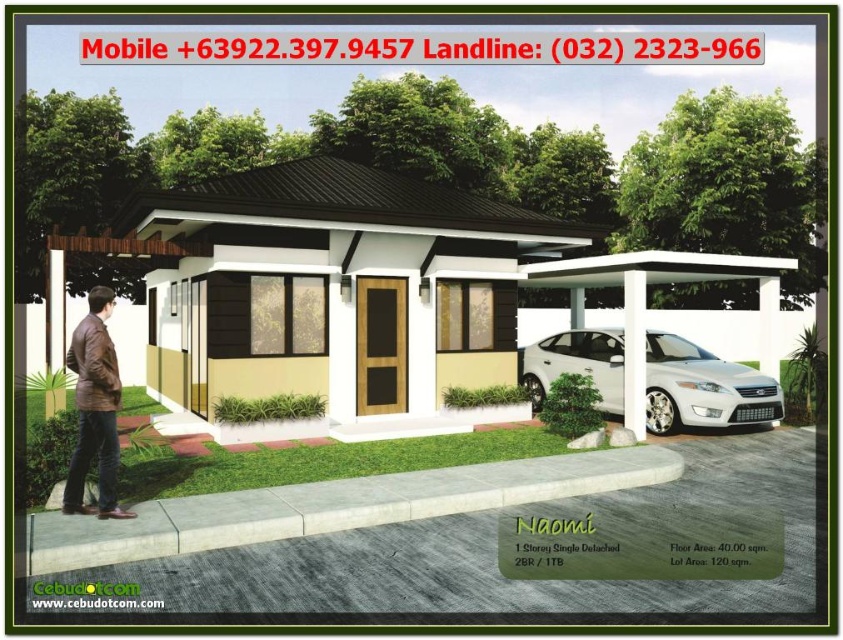
Is white glossy sedan at center closer to camera compared to brown leather jacket at lower left?

That is False.

Does point (599, 336) come in front of point (111, 499)?

That is False.

Which is in front, point (578, 333) or point (100, 353)?

Point (100, 353)

Find the location of a particular element. white glossy sedan at center is located at coordinates (702, 387).

Between point (677, 416) and point (631, 368), which one is positioned behind?

Positioned behind is point (677, 416).

Who is positioned more to the left, white glossy sedan at center or white smooth pillar at right?

Positioned to the left is white glossy sedan at center.

At what (x,y) coordinates should I click in order to perform the action: click on white glossy sedan at center. Please return your answer as a coordinate pair (x, y). The width and height of the screenshot is (843, 640). Looking at the image, I should click on (702, 387).

In order to click on white glossy sedan at center in this screenshot , I will do `click(702, 387)`.

Is brown leather jacket at lower left below white smooth pillar at right?

Indeed, brown leather jacket at lower left is positioned under white smooth pillar at right.

Which is behind, point (78, 432) or point (639, 362)?

Point (639, 362)

Who is more forward, (x=109, y=442) or (x=636, y=380)?

Point (x=109, y=442) is more forward.

Locate an element on the screen. brown leather jacket at lower left is located at coordinates (94, 408).